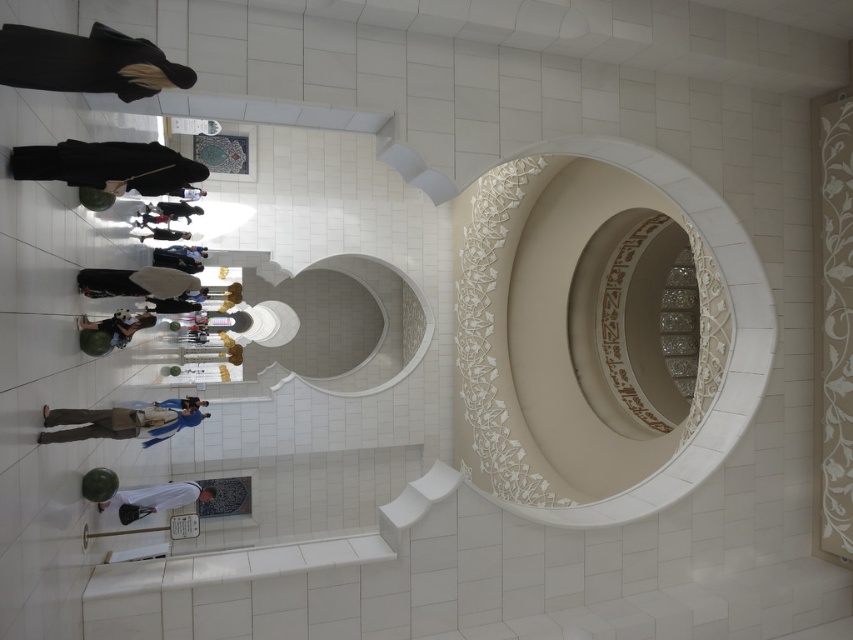
Question: Can you confirm if white carved stone at center is positioned below white glossy mirror at center?

Choices:
 (A) yes
 (B) no

Answer: (B)

Question: Which of the following is the closest to the observer?

Choices:
 (A) (334, 353)
 (B) (523, 417)

Answer: (B)

Question: Can you confirm if white carved stone at center is positioned to the right of white glossy mirror at center?

Choices:
 (A) yes
 (B) no

Answer: (A)

Question: Which object is closer to the camera taking this photo?

Choices:
 (A) white glossy mirror at center
 (B) white carved stone at center

Answer: (B)

Question: Can you confirm if white carved stone at center is positioned above white glossy mirror at center?

Choices:
 (A) yes
 (B) no

Answer: (A)